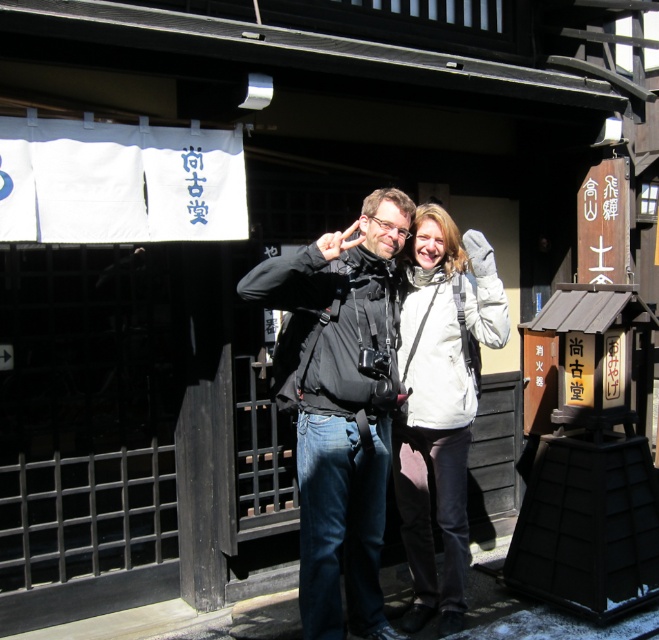
Who is lower down, black matte jacket at center or white matte jacket at center?

white matte jacket at center is below.

Can you confirm if black matte jacket at center is positioned below white matte jacket at center?

Actually, black matte jacket at center is above white matte jacket at center.

What do you see at coordinates (341, 406) in the screenshot?
I see `black matte jacket at center` at bounding box center [341, 406].

I want to click on black matte jacket at center, so click(341, 406).